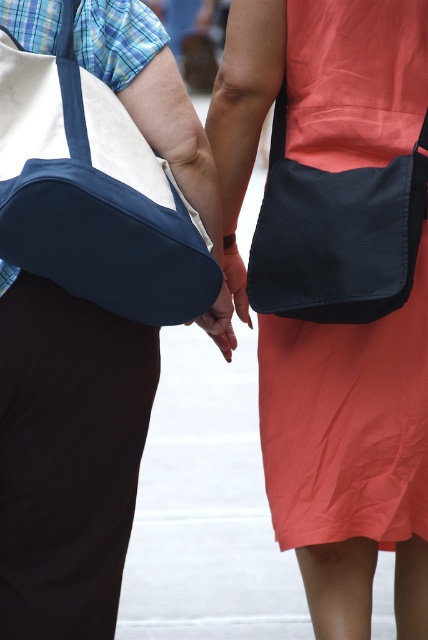
You are a photographer standing in front of the scene. You want to take a close up photo of the matte black apron at center. Considering the current distance between you and the apron, is it possible to capture a clear close up without moving closer?

The matte black apron at center is 3.33 meters away from viewer. To capture a clear close up, you need to be closer than 3.33 meters. Since you are currently at 3.33 meters, you need to move slightly closer to ensure the apron fills the frame properly.

You are standing in a park and see a person holding a blue canvas messenger bag at left. If you want to hand them a flyer from 10 feet away, will you be able to reach them without moving closer?

The blue canvas messenger bag at left is 9.05 feet away from the viewer, which is less than 10 feet. Therefore, you can reach them by extending your arm to hand the flyer without needing to move closer.

You are a photographer trying to capture a close shot of the blue canvas messenger bag at left. You notice a point at coordinates point (92, 193). Based on the scene description, where is this point located?

The point (92, 193) is located on the blue canvas messenger bag at left.